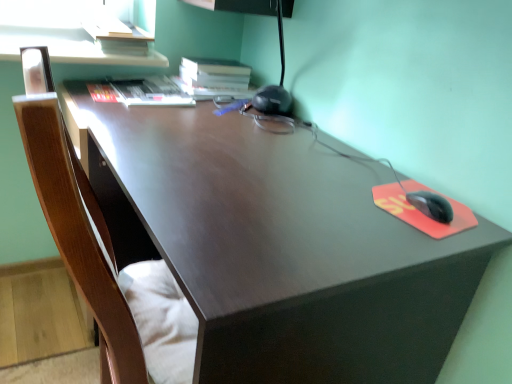
Question: Is hardcover book at upper left, the 2th book in the right-to-left sequence, not near hardcover book at upper center, marked as the 1th book in a right-to-left arrangement?

Choices:
 (A) no
 (B) yes

Answer: (A)

Question: Is hardcover book at upper left, the first book viewed from the left, taller than hardcover book at upper center, the second book viewed from the left?

Choices:
 (A) yes
 (B) no

Answer: (B)

Question: From the image's perspective, is hardcover book at upper left, the 2th book in the right-to-left sequence, under hardcover book at upper center, marked as the 1th book in a right-to-left arrangement?

Choices:
 (A) yes
 (B) no

Answer: (A)

Question: Is hardcover book at upper left, the 2th book in the right-to-left sequence, oriented away from hardcover book at upper center, the second book viewed from the left?

Choices:
 (A) no
 (B) yes

Answer: (B)

Question: Does hardcover book at upper left, the first book viewed from the left, have a lesser width compared to hardcover book at upper center, marked as the 1th book in a right-to-left arrangement?

Choices:
 (A) no
 (B) yes

Answer: (B)

Question: Is hardcover book at upper left, the first book viewed from the left, taller or shorter than matte brown desk at center?

Choices:
 (A) tall
 (B) short

Answer: (B)

Question: Would you say hardcover book at upper left, the first book viewed from the left, is inside or outside matte brown desk at center?

Choices:
 (A) inside
 (B) outside

Answer: (A)

Question: Is hardcover book at upper left, the first book viewed from the left, wider or thinner than matte brown desk at center?

Choices:
 (A) wide
 (B) thin

Answer: (B)

Question: In terms of size, does hardcover book at upper left, the 2th book in the right-to-left sequence, appear bigger or smaller than matte brown desk at center?

Choices:
 (A) big
 (B) small

Answer: (B)

Question: Visually, is matte brown desk at center positioned to the left or to the right of hardcover book at upper left, the 2th book in the right-to-left sequence?

Choices:
 (A) right
 (B) left

Answer: (A)

Question: Considering the positions of matte brown desk at center and hardcover book at upper left, the first book viewed from the left, in the image, is matte brown desk at center wider or thinner than hardcover book at upper left, the first book viewed from the left,?

Choices:
 (A) thin
 (B) wide

Answer: (B)

Question: Is matte brown desk at center in front of or behind hardcover book at upper left, the 2th book in the right-to-left sequence, in the image?

Choices:
 (A) behind
 (B) front

Answer: (B)

Question: Is matte brown desk at center situated inside hardcover book at upper left, the first book viewed from the left, or outside?

Choices:
 (A) inside
 (B) outside

Answer: (B)

Question: Is hardcover book at upper center, the second book viewed from the left, wider or thinner than matte brown desk at center?

Choices:
 (A) thin
 (B) wide

Answer: (A)

Question: Based on their positions, is hardcover book at upper center, the second book viewed from the left, located to the left or right of matte brown desk at center?

Choices:
 (A) left
 (B) right

Answer: (A)